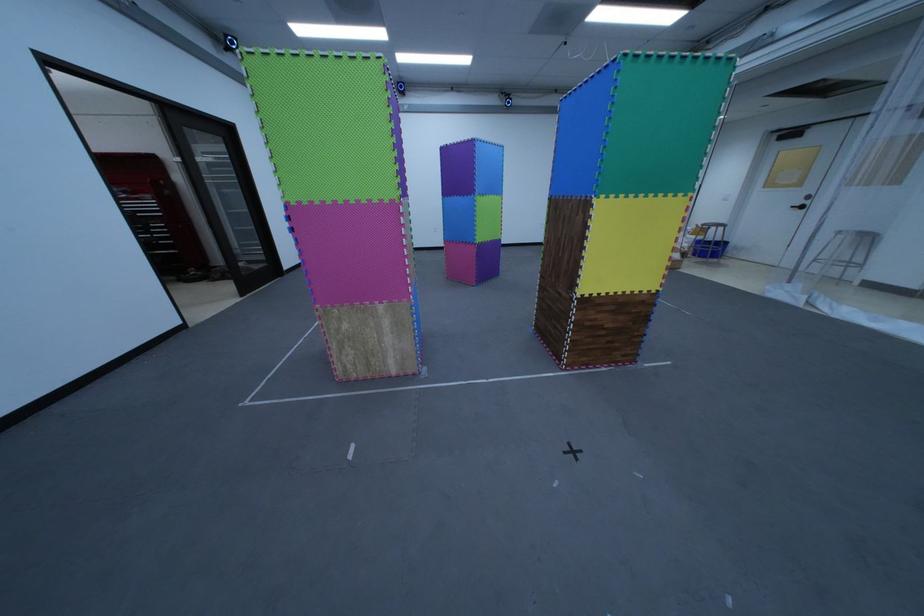
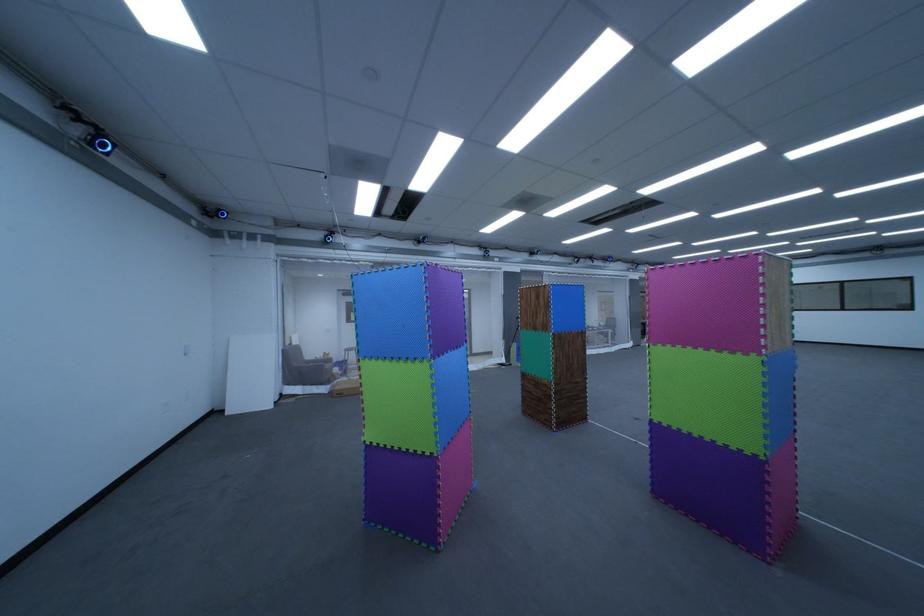
Locate, in the second image, the point that corresponds to point (796, 140) in the first image.

(359, 296)